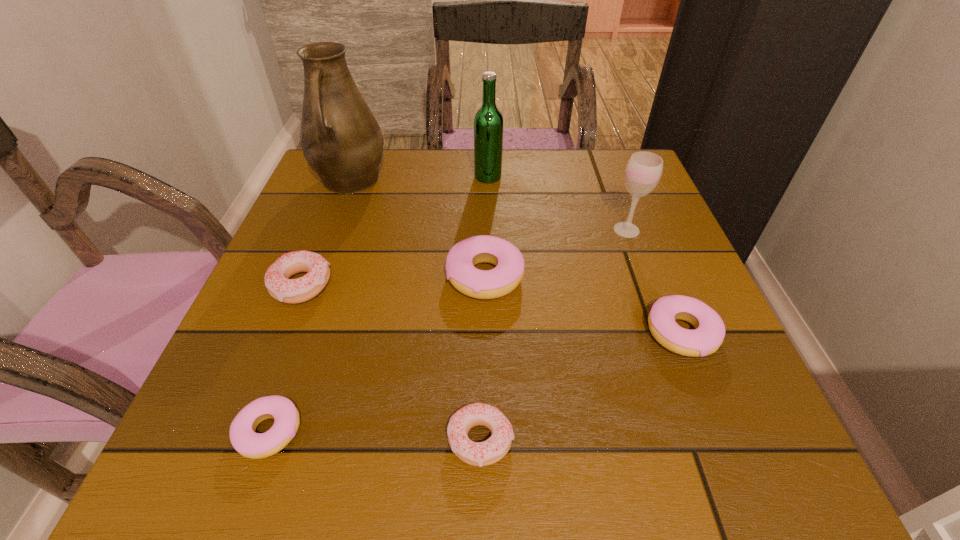
Locate which pink doughnut ranks second in proximity to the rightmost doughnut. Please provide its 2D coordinates. Your answer should be formatted as a tuple, i.e. [(x, y)], where the tuple contains the x and y coordinates of a point satisfying the conditions above.

[(245, 440)]

Image resolution: width=960 pixels, height=540 pixels. In order to click on pink doughnut that is the second closest to the seventh shortest object in this screenshot , I will do `click(708, 335)`.

Image resolution: width=960 pixels, height=540 pixels. I want to click on free spot that satisfies the following two spatial constraints: 1. on the back side of the left white doughnut; 2. on the left side of the second pink doughnut from left to right, so (x=304, y=276).

At what (x,y) coordinates should I click in order to perform the action: click on vacant space that satisfies the following two spatial constraints: 1. on the front side of the seventh shortest object; 2. on the right side of the second smallest pink doughnut. Please return your answer as a coordinate pair (x, y). The height and width of the screenshot is (540, 960). Looking at the image, I should click on coord(492,333).

Identify the location of free space that satisfies the following two spatial constraints: 1. on the back side of the biggest pink doughnut; 2. on the right side of the second tallest object. (484, 177).

Identify the location of free space that satisfies the following two spatial constraints: 1. on the back side of the sixth shortest object; 2. on the right side of the farthest pink doughnut. (484, 230).